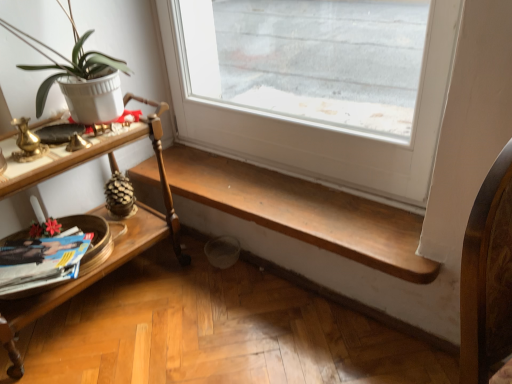
Question: Is matte paper magazine at lower left wider or thinner than white matte pot at left?

Choices:
 (A) thin
 (B) wide

Answer: (B)

Question: Is point (5, 273) positioned closer to the camera than point (74, 64)?

Choices:
 (A) closer
 (B) farther

Answer: (A)

Question: Considering the real-world distances, which object is closest to the woodenmaterial/textureshelf at left?

Choices:
 (A) matte paper magazine at lower left
 (B) wooden bench at lower center
 (C) white matte pot at left

Answer: (A)

Question: Based on their relative distances, which object is nearer to the matte paper magazine at lower left?

Choices:
 (A) woodenmaterial/textureshelf at left
 (B) wooden bench at lower center
 (C) white matte pot at left

Answer: (A)